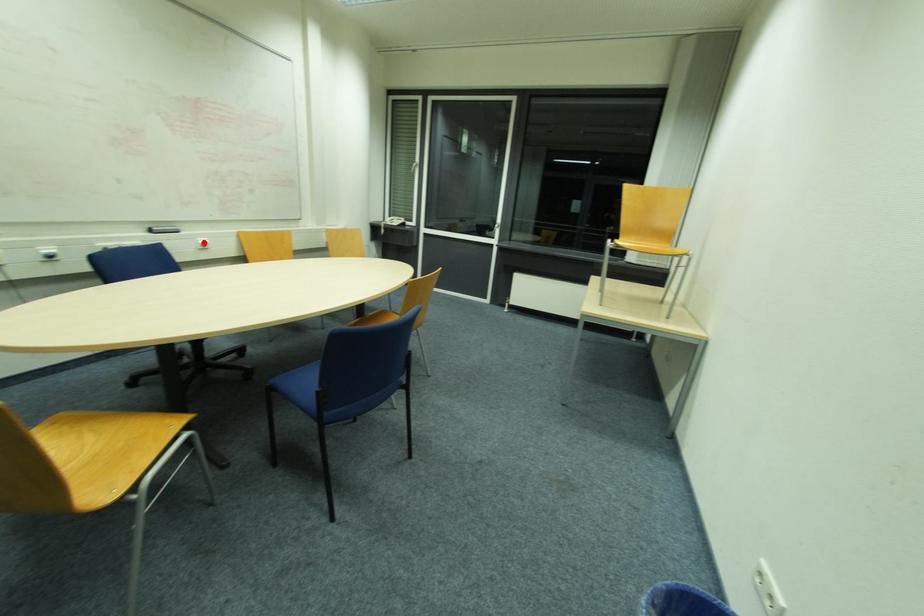
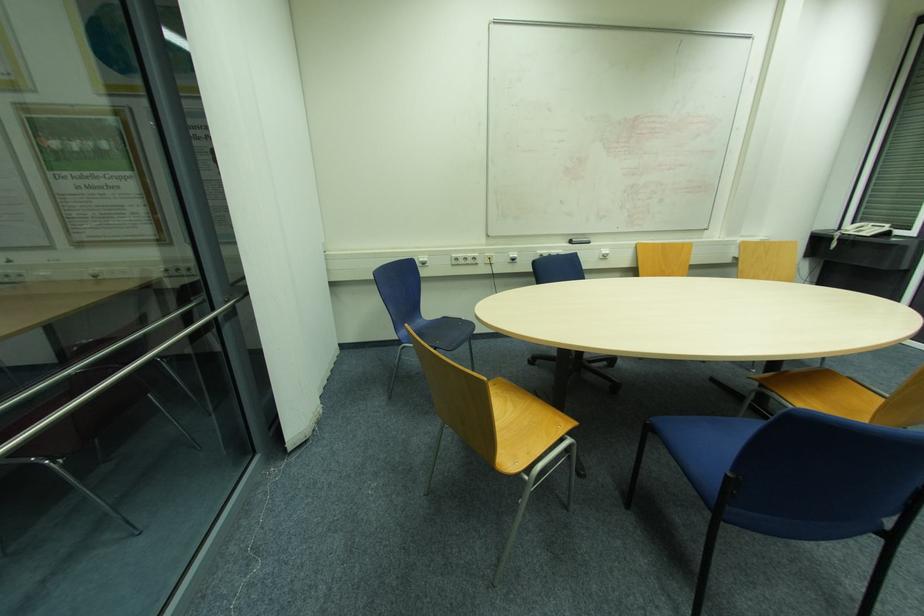
In the second image, find the point that corresponds to the highlighted location in the first image.

(604, 253)